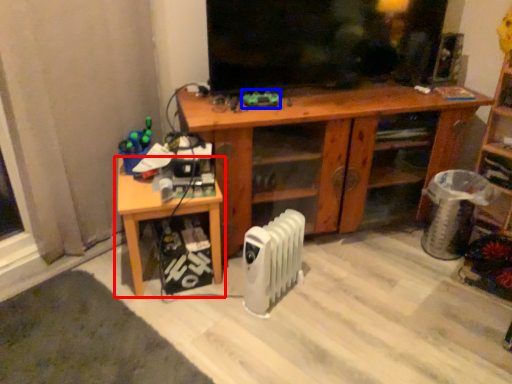
Question: Which of the following is the closest to the observer, table (highlighted by a red box) or toy (highlighted by a blue box)?

Choices:
 (A) table
 (B) toy

Answer: (A)